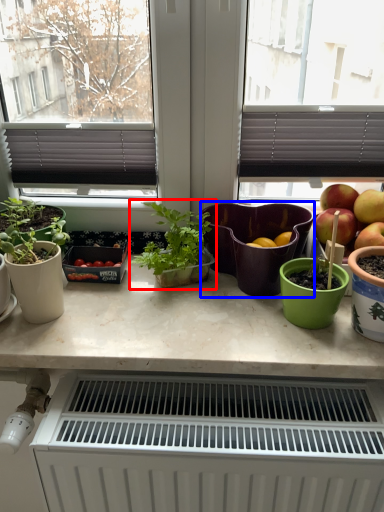
Question: Which object appears farthest to the camera in this image, houseplant (highlighted by a red box) or flowerpot (highlighted by a blue box)?

Choices:
 (A) houseplant
 (B) flowerpot

Answer: (B)